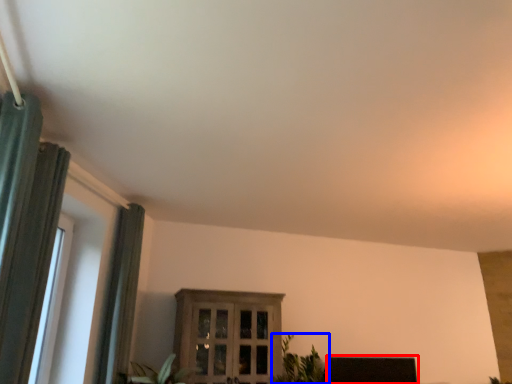
Question: Among these objects, which one is farthest to the camera, furniture (highlighted by a red box) or houseplant (highlighted by a blue box)?

Choices:
 (A) furniture
 (B) houseplant

Answer: (A)